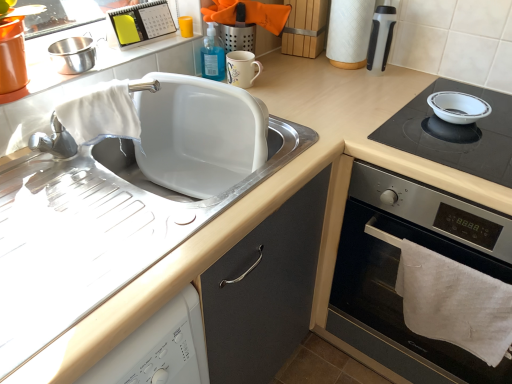
Identify the location of vacant space in between matte ceramic mug at upper center, the 2th appliance in the right-to-left sequence, and white paper towel at upper right. (298, 80).